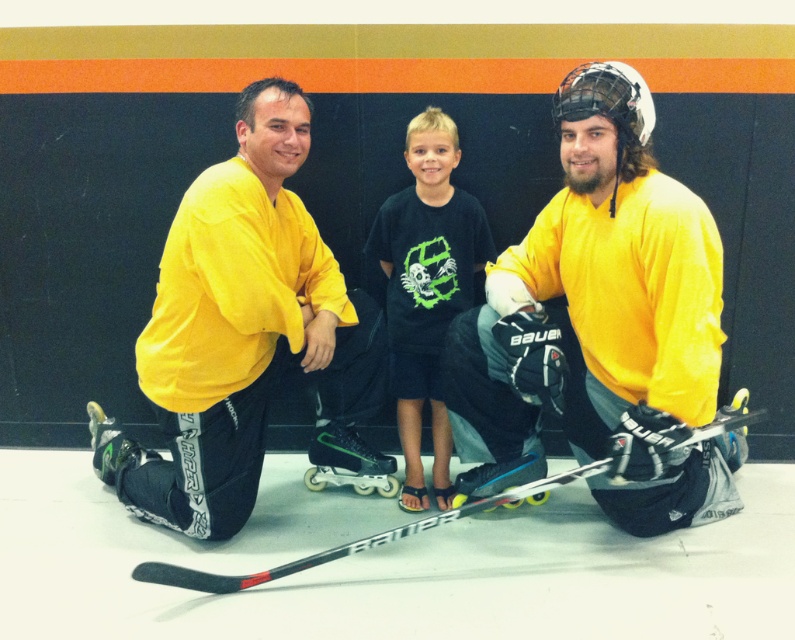
You are a photographer at an indoor ice rink. You need to take a photo of the yellow matte hockey jersey at right and the matte yellow jersey at center so that both are clearly visible. Which jersey should you focus on to ensure the shorter one is not blocked?

You should focus on the matte yellow jersey at center because it is shorter than the yellow matte hockey jersey at right, so positioning the camera to highlight the shorter one would prevent it from being blocked.